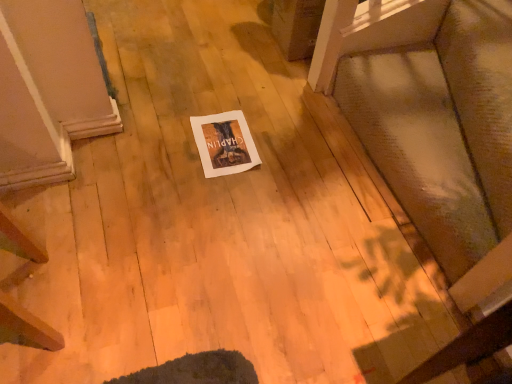
Where is `textured fabric cushion at lower right`? The image size is (512, 384). textured fabric cushion at lower right is located at coordinates (436, 141).

What do you see at coordinates (436, 141) in the screenshot? I see `textured fabric cushion at lower right` at bounding box center [436, 141].

What do you see at coordinates (224, 143) in the screenshot? I see `white paper at center` at bounding box center [224, 143].

Identify the location of white paper at center. The height and width of the screenshot is (384, 512). (224, 143).

The width and height of the screenshot is (512, 384). Find the location of `textured fabric cushion at lower right`. textured fabric cushion at lower right is located at coordinates (436, 141).

Is textured fabric cushion at lower right to the left of white paper at center from the viewer's perspective?

No.

Considering the positions of objects textured fabric cushion at lower right and white paper at center in the image provided, who is in front, textured fabric cushion at lower right or white paper at center?

textured fabric cushion at lower right is more forward.

Which is behind, point (506, 213) or point (219, 156)?

The point (219, 156) is farther from the camera.

From the image's perspective, does textured fabric cushion at lower right appear lower than white paper at center?

No, from the image's perspective, textured fabric cushion at lower right is not beneath white paper at center.

From a real-world perspective, is textured fabric cushion at lower right physically located above or below white paper at center?

textured fabric cushion at lower right is situated higher than white paper at center in the real world.

Is textured fabric cushion at lower right thinner than white paper at center?

Incorrect, the width of textured fabric cushion at lower right is not less than that of white paper at center.

Does textured fabric cushion at lower right have a greater height compared to white paper at center?

Indeed, textured fabric cushion at lower right has a greater height compared to white paper at center.

Between textured fabric cushion at lower right and white paper at center, which one has larger size?

textured fabric cushion at lower right.

Would you say white paper at center is part of textured fabric cushion at lower right's contents?

No, white paper at center is not a part of textured fabric cushion at lower right.

Is there a large distance between textured fabric cushion at lower right and white paper at center?

No, textured fabric cushion at lower right is not far away from white paper at center.

Is textured fabric cushion at lower right positioned with its back to white paper at center?

textured fabric cushion at lower right does not have its back to white paper at center.

How different are the orientations of textured fabric cushion at lower right and white paper at center in degrees?

They differ by 2.49 degrees in their facing directions.

Measure the distance from textured fabric cushion at lower right to white paper at center.

textured fabric cushion at lower right is 22.90 inches from white paper at center.

Locate an element on the screen. This screenshot has width=512, height=384. postcard that appears below the textured fabric cushion at lower right (from the image's perspective) is located at coordinates (224, 143).

Considering the positions of objects white paper at center and textured fabric cushion at lower right in the image provided, who is more to the right, white paper at center or textured fabric cushion at lower right?

textured fabric cushion at lower right.

Does white paper at center come behind textured fabric cushion at lower right?

That is True.

Does point (203, 129) lie in front of point (509, 171)?

No, it is not.

From the image's perspective, would you say white paper at center is shown under textured fabric cushion at lower right?

Correct, white paper at center appears lower than textured fabric cushion at lower right in the image.

From a real-world perspective, does white paper at center stand above textured fabric cushion at lower right?

No, from a real-world perspective, white paper at center is not above textured fabric cushion at lower right.

In terms of width, does white paper at center look wider or thinner when compared to textured fabric cushion at lower right?

Clearly, white paper at center has less width compared to textured fabric cushion at lower right.

Who is taller, white paper at center or textured fabric cushion at lower right?

textured fabric cushion at lower right.

Does white paper at center have a smaller size compared to textured fabric cushion at lower right?

Yes, white paper at center is smaller than textured fabric cushion at lower right.

Is textured fabric cushion at lower right completely or partially inside white paper at center?

Definitely not — textured fabric cushion at lower right is not inside white paper at center.

Does white paper at center touch textured fabric cushion at lower right?

No, white paper at center is not touching textured fabric cushion at lower right.

In the scene shown: Is white paper at center oriented towards textured fabric cushion at lower right?

No, white paper at center is not aimed at textured fabric cushion at lower right.

The image size is (512, 384). In order to click on postcard that appears below the textured fabric cushion at lower right (from a real-world perspective) in this screenshot , I will do `click(224, 143)`.

In order to click on postcard lying below the textured fabric cushion at lower right (from the image's perspective) in this screenshot , I will do `click(224, 143)`.

Where is `furniture on the right of white paper at center`? The height and width of the screenshot is (384, 512). furniture on the right of white paper at center is located at coordinates tap(436, 141).